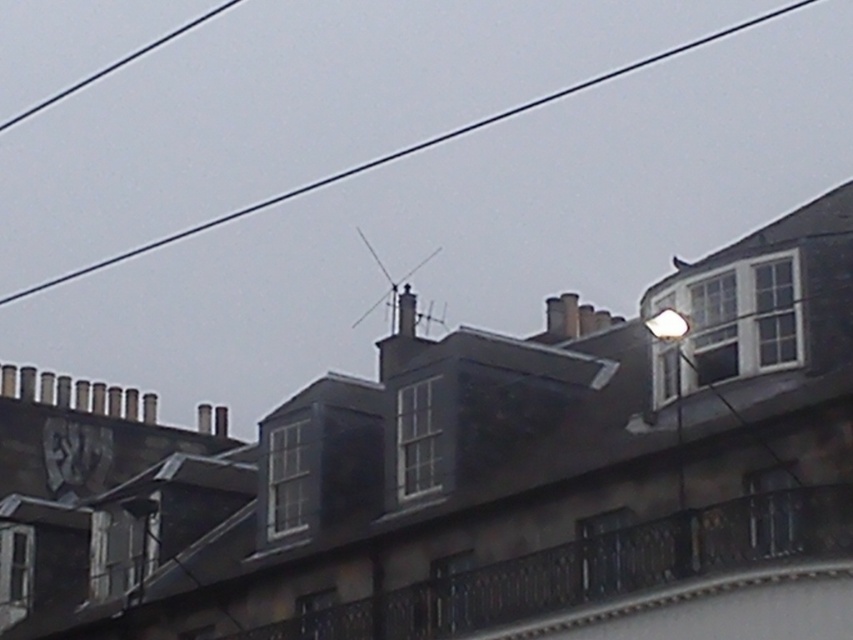
Does black wire at upper center have a greater width compared to metallic gray clock at upper left?

Yes.

Which of these two, black wire at upper center or metallic gray clock at upper left, stands shorter?

metallic gray clock at upper left

The height and width of the screenshot is (640, 853). Describe the element at coordinates (405, 150) in the screenshot. I see `black wire at upper center` at that location.

Identify the location of black wire at upper center. (405, 150).

Between point (306, 189) and point (409, 317), which one is positioned in front?

Point (409, 317)

Which is more to the right, black wire at upper center or smooth gray chimney at center?

smooth gray chimney at center

Locate an element on the screen. black wire at upper center is located at coordinates (405, 150).

Find the location of a particular element. This screenshot has height=640, width=853. black wire at upper center is located at coordinates (405, 150).

The width and height of the screenshot is (853, 640). Describe the element at coordinates (74, 456) in the screenshot. I see `metallic gray clock at upper left` at that location.

Locate an element on the screen. This screenshot has width=853, height=640. metallic gray clock at upper left is located at coordinates (74, 456).